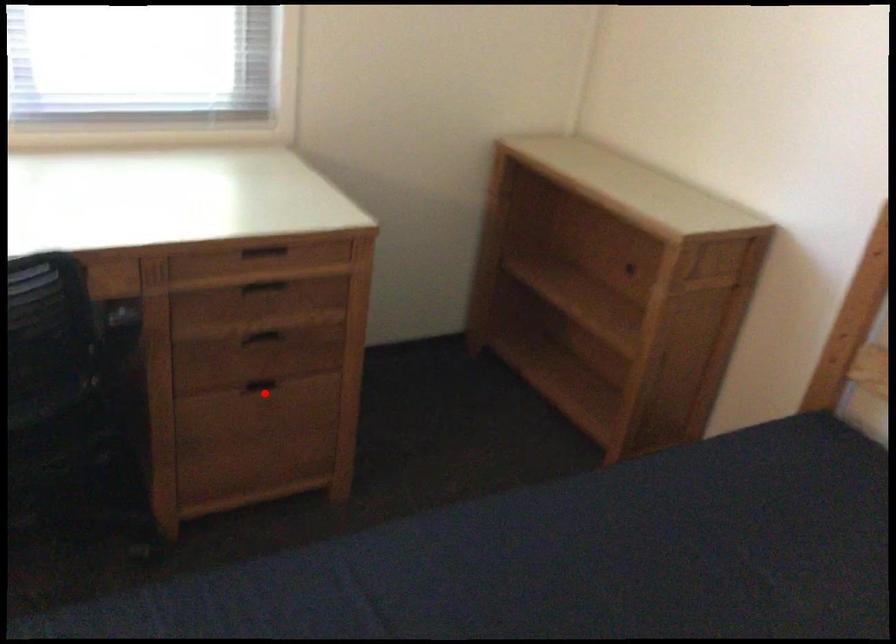
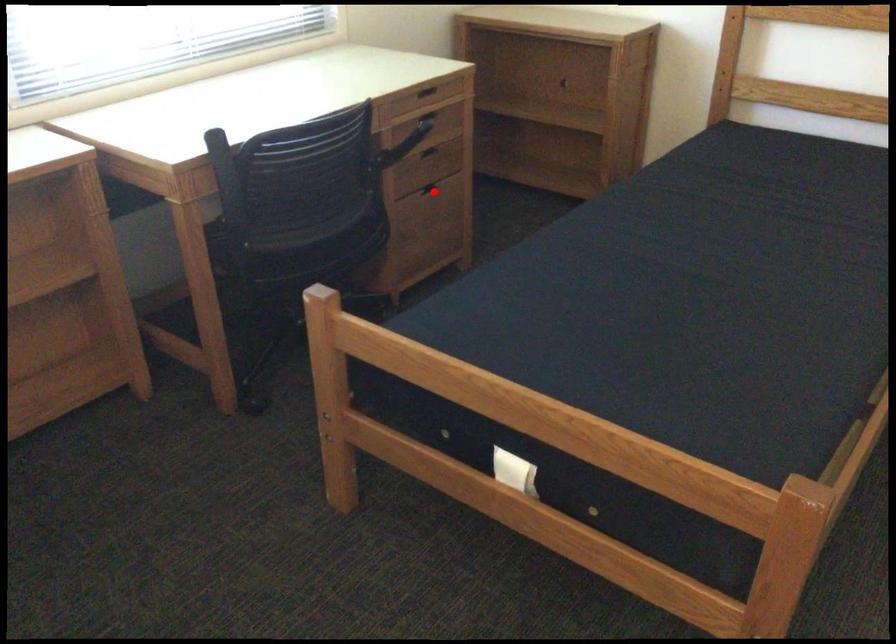
Looking at this image, I am providing you with two images of the same scene from different viewpoints. A red point is marked on the first image and another point is marked on the second image. Is the red point in image1 aligned with the point shown in image2?

Yes